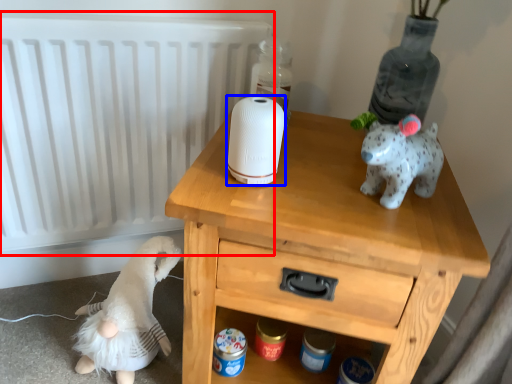
Question: Which of the following is the farthest to the observer, radiator (highlighted by a red box) or toilet paper (highlighted by a blue box)?

Choices:
 (A) radiator
 (B) toilet paper

Answer: (A)